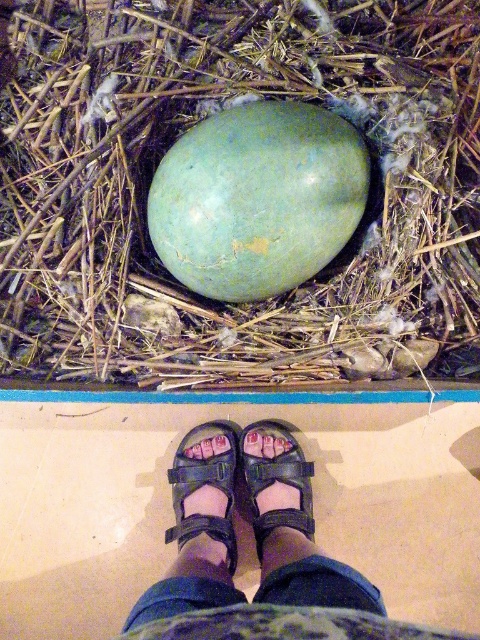
Can you confirm if greenish-blue egg at center is wider than black leather sandal at center?

Correct, the width of greenish-blue egg at center exceeds that of black leather sandal at center.

At what (x,y) coordinates should I click in order to perform the action: click on greenish-blue egg at center. Please return your answer as a coordinate pair (x, y). Looking at the image, I should click on (179, 136).

Does green matte egg at center have a smaller size compared to black fabric sandal at lower center?

Incorrect, green matte egg at center is not smaller in size than black fabric sandal at lower center.

Looking at this image, does green matte egg at center have a larger size compared to black fabric sandal at lower center?

Correct, green matte egg at center is larger in size than black fabric sandal at lower center.

Identify the location of green matte egg at center. Image resolution: width=480 pixels, height=640 pixels. (257, 198).

Between black leather sandal at center and black fabric sandal at lower center, which one has less height?

black fabric sandal at lower center is shorter.

Who is taller, black leather sandal at center or black fabric sandal at lower center?

black leather sandal at center is taller.

Does point (216, 534) come in front of point (248, 467)?

Yes, it is in front of point (248, 467).

Where is `black leather sandal at center`? This screenshot has width=480, height=640. black leather sandal at center is located at coordinates (205, 484).